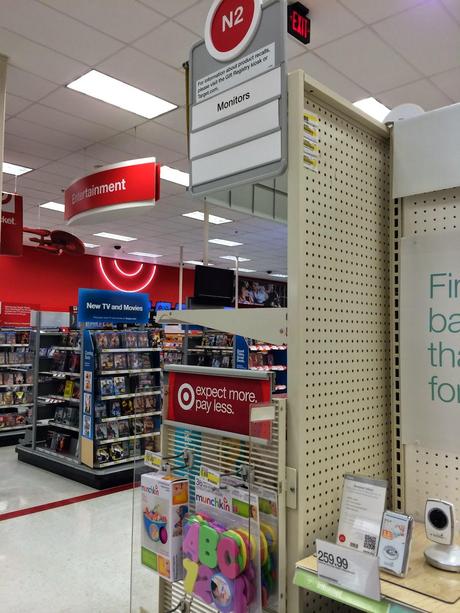
The image size is (460, 613). I want to click on red wall, so click(51, 281).